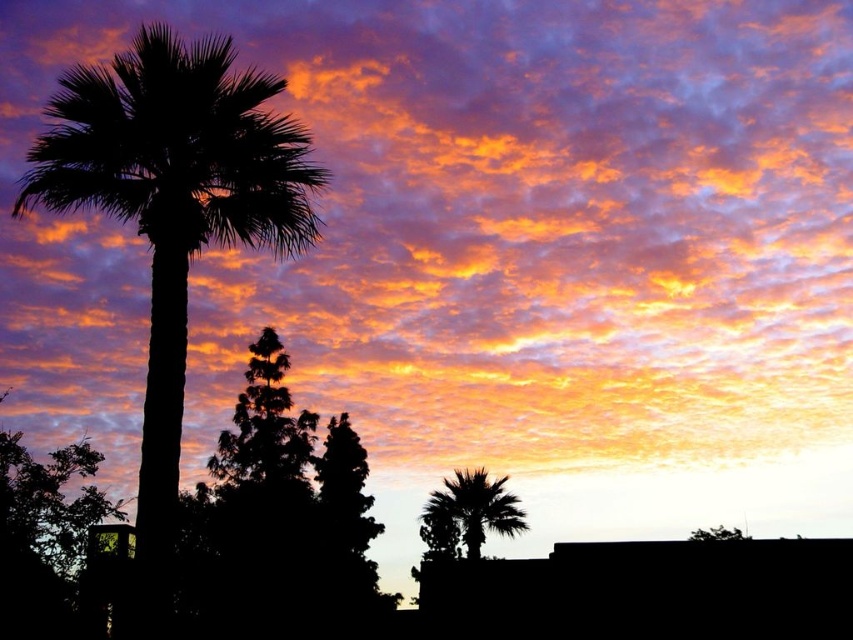
Question: Does silhouette palm tree at left appear over silhouette palm tree at lower right?

Choices:
 (A) no
 (B) yes

Answer: (B)

Question: Observing the image, what is the correct spatial positioning of silhouette palm tree at left in reference to silhouette palm tree at lower right?

Choices:
 (A) left
 (B) right

Answer: (A)

Question: Can you confirm if silhouette palm tree at left is smaller than silhouette palm tree at lower right?

Choices:
 (A) yes
 (B) no

Answer: (B)

Question: Which point is farther to the camera?

Choices:
 (A) silhouette palm tree at left
 (B) silhouette palm tree at lower right

Answer: (B)

Question: Which object is closer to the camera taking this photo?

Choices:
 (A) silhouette palm tree at left
 (B) silhouette palm tree at lower right

Answer: (A)

Question: Which of the following is the farthest from the observer?

Choices:
 (A) (263, 186)
 (B) (468, 545)

Answer: (B)